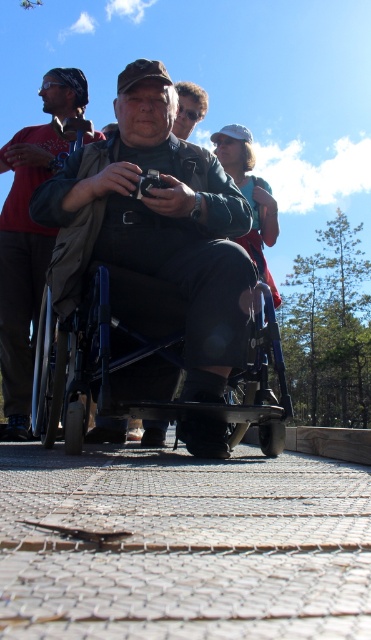
Measure the distance between point (179, 413) and camera.

A distance of 7.71 feet exists between point (179, 413) and camera.

Does metallic blue wheelchair at center have a lesser width compared to brown leather jacket at upper left?

No.

Is point (41, 433) in front of point (1, 241)?

That is True.

I want to click on metallic blue wheelchair at center, so click(90, 365).

Who is taller, matte black wheelchair at center or metallic blue wheelchair at center?

With more height is matte black wheelchair at center.

Who is positioned more to the right, matte black wheelchair at center or metallic blue wheelchair at center?

matte black wheelchair at center

Is point (106, 161) behind point (104, 305)?

Yes, it is behind point (104, 305).

Image resolution: width=371 pixels, height=640 pixels. Find the location of `matte black wheelchair at center`. matte black wheelchair at center is located at coordinates (158, 224).

Which of these two, matte black wheelchair at center or brown leather jacket at upper left, stands shorter?

brown leather jacket at upper left is shorter.

Where is `matte black wheelchair at center`? The height and width of the screenshot is (640, 371). matte black wheelchair at center is located at coordinates tap(158, 224).

Locate an element on the screen. matte black wheelchair at center is located at coordinates (158, 224).

Identify the location of matte black wheelchair at center. Image resolution: width=371 pixels, height=640 pixels. coord(158,224).